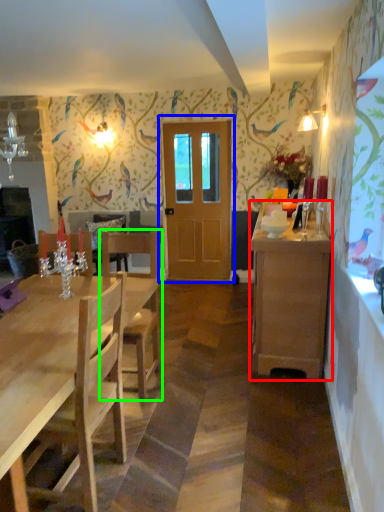
Question: Which is nearer to the cabinetry (highlighted by a red box)? door (highlighted by a blue box) or chair (highlighted by a green box).

Choices:
 (A) door
 (B) chair

Answer: (B)